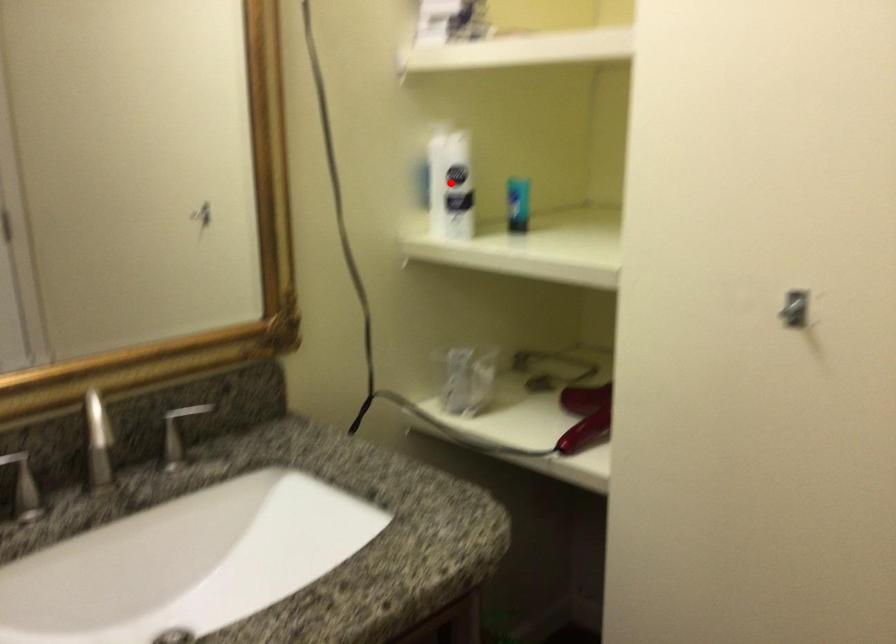
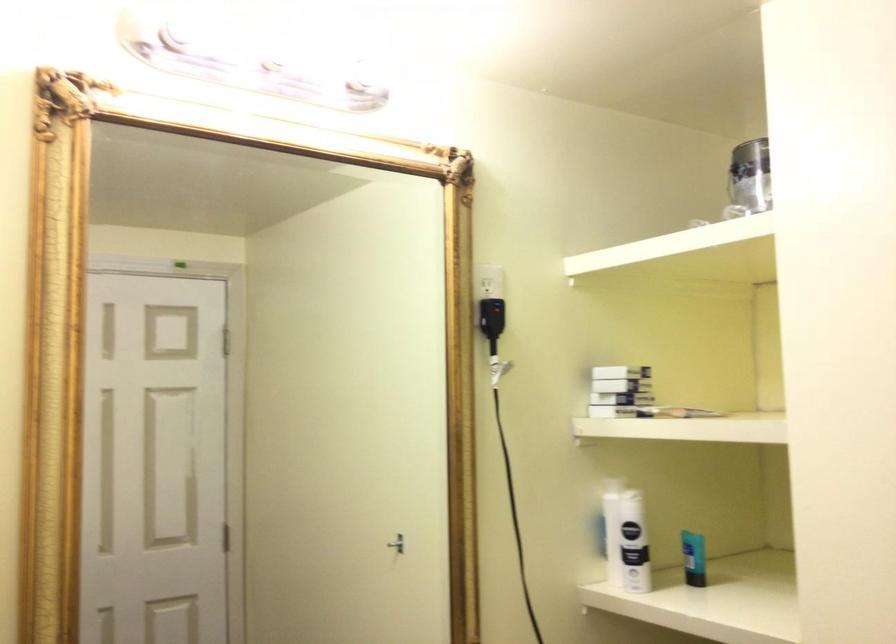
Locate, in the second image, the point that corresponds to the highlighted location in the first image.

(625, 538)